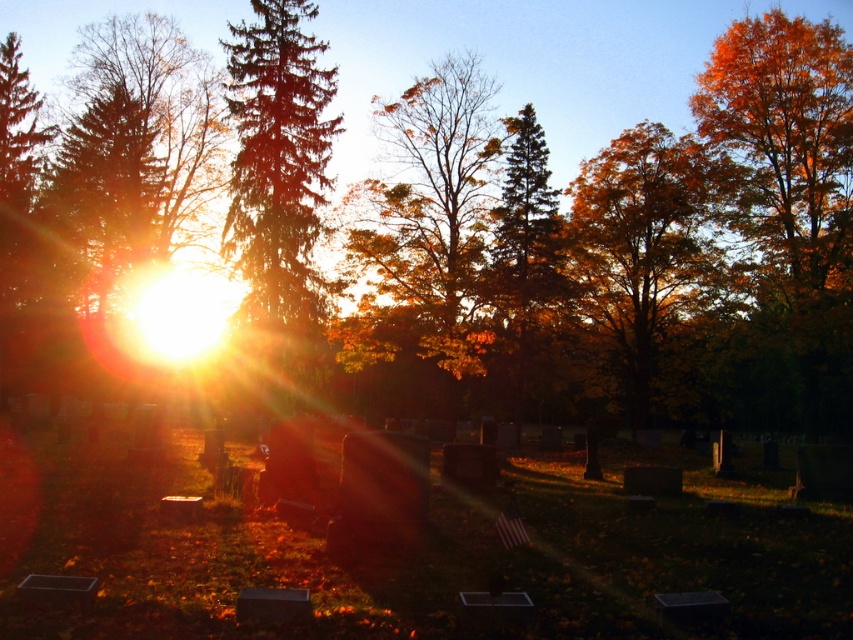
Question: Which object appears closest to the camera in this image?

Choices:
 (A) orange leafy tree at center
 (B) green matte evergreen tree at center
 (C) autumn leaves at center
 (D) green glossy tree at center

Answer: (B)

Question: Which is nearer to the autumn leaves at center?

Choices:
 (A) green glossy tree at center
 (B) green matte evergreen tree at center

Answer: (B)

Question: Can you confirm if autumn leaves at center is positioned to the left of orange leafy tree at center?

Choices:
 (A) no
 (B) yes

Answer: (B)

Question: Can you confirm if green glossy tree at center is positioned to the left of green matte evergreen tree at center?

Choices:
 (A) no
 (B) yes

Answer: (B)

Question: Is green glossy tree at center further to camera compared to green matte evergreen tree at center?

Choices:
 (A) yes
 (B) no

Answer: (A)

Question: Which is farther from the autumn leaves at center?

Choices:
 (A) green matte evergreen tree at center
 (B) green glossy tree at center

Answer: (B)